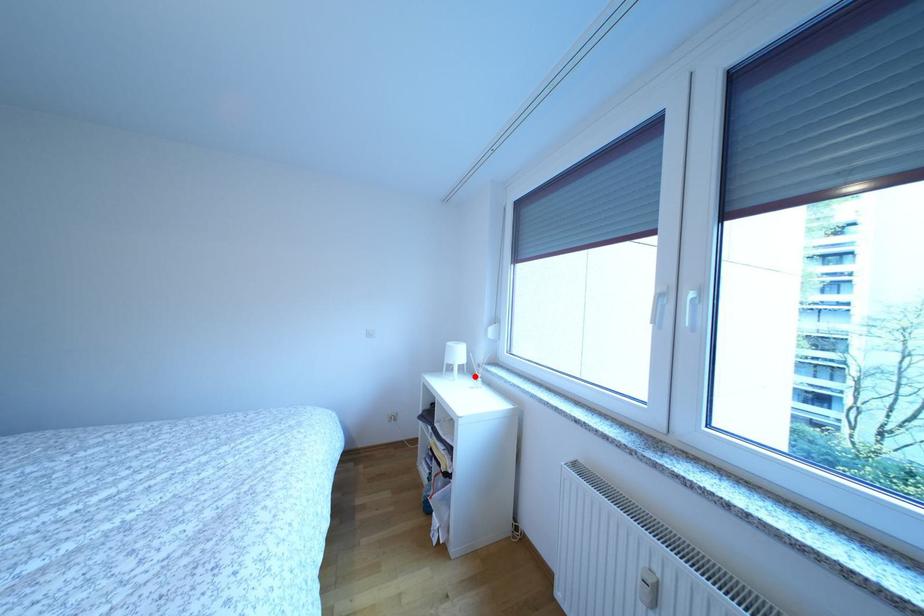
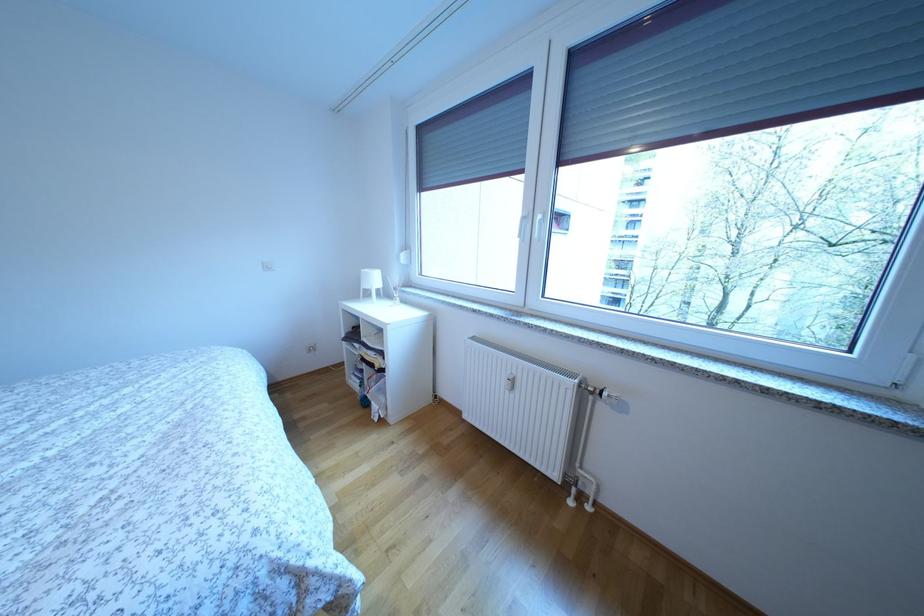
Question: A red point is marked in image1. In image2, is the corresponding 3D point closer to the camera or farther? Reply with the corresponding letter.

Choices:
 (A) The corresponding 3D point is closer.
 (B) The corresponding 3D point is farther.

Answer: (A)